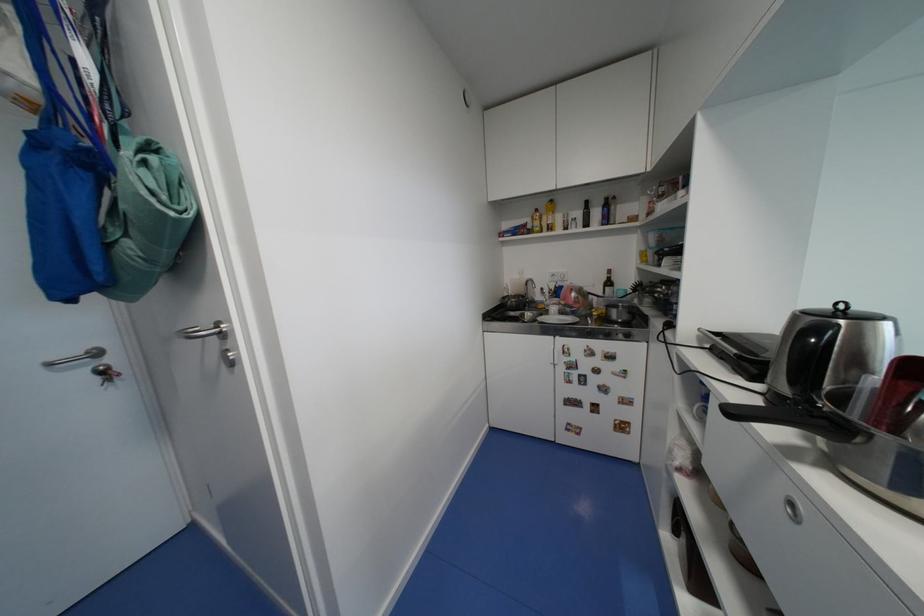
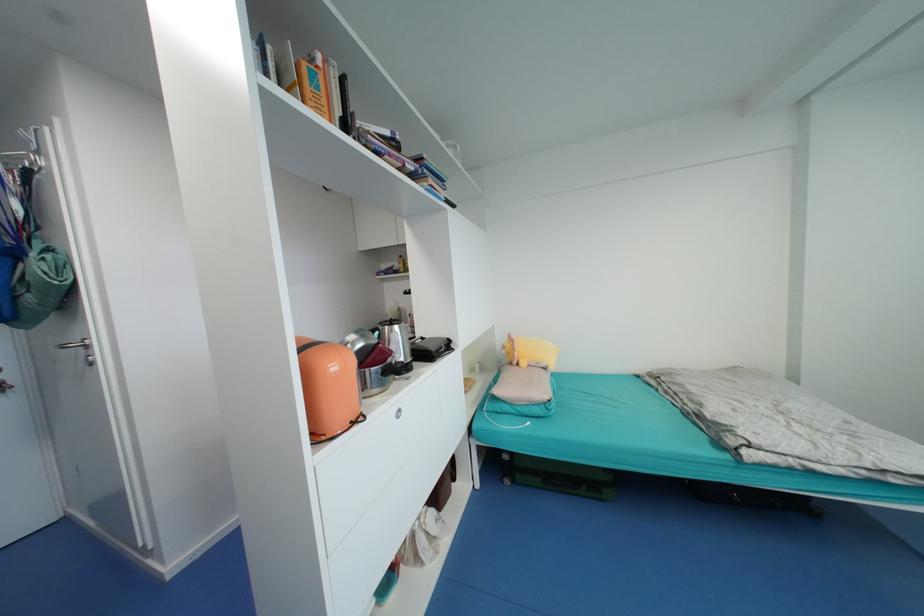
Locate, in the second image, the point that corresponds to point 184,185 in the first image.

(68, 267)